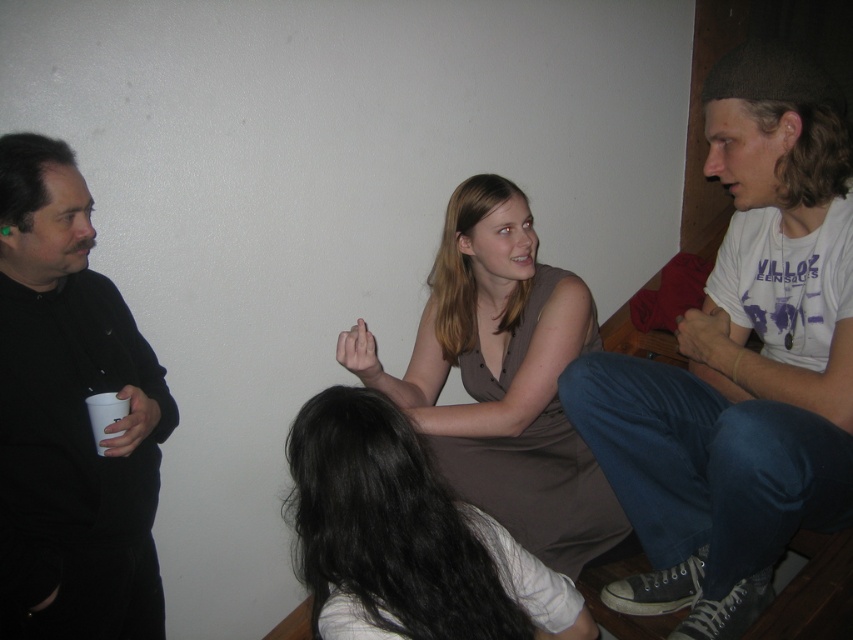
Question: Is black matte shirt at left thinner than smooth brown dress at center?

Choices:
 (A) no
 (B) yes

Answer: (B)

Question: Which point is farther to the camera?

Choices:
 (A) brown matte dress at center
 (B) white cotton t-shirt at upper right
 (C) black matte shirt at left

Answer: (A)

Question: Can you confirm if black matte shirt at left is positioned to the left of smooth brown dress at center?

Choices:
 (A) no
 (B) yes

Answer: (B)

Question: Can you confirm if white cotton t-shirt at upper right is thinner than smooth brown dress at center?

Choices:
 (A) no
 (B) yes

Answer: (A)

Question: Which is nearer to the brown matte dress at center?

Choices:
 (A) smooth brown dress at center
 (B) black matte shirt at left

Answer: (B)

Question: Which object appears farthest from the camera in this image?

Choices:
 (A) white cotton t-shirt at upper right
 (B) black matte shirt at left

Answer: (B)